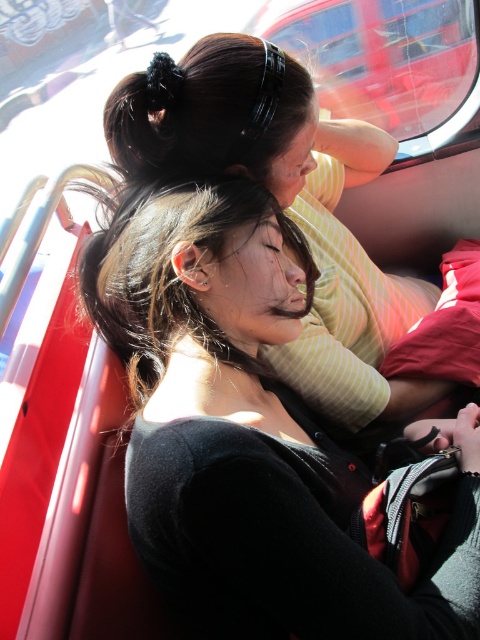
Locate an element on the screen. The width and height of the screenshot is (480, 640). black matte hair at center is located at coordinates (248, 433).

Is black matte hair at center thinner than black matte hair at upper center?

Indeed, black matte hair at center has a lesser width compared to black matte hair at upper center.

The image size is (480, 640). In order to click on black matte hair at center in this screenshot , I will do `click(248, 433)`.